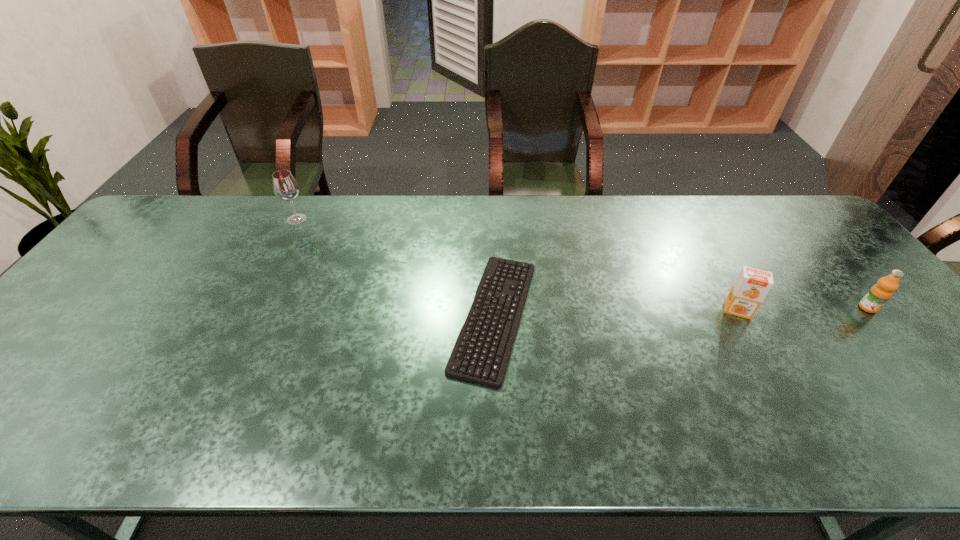
Locate an element on the screen. This screenshot has width=960, height=540. the tallest object is located at coordinates (285, 187).

Identify the location of wineglass. This screenshot has width=960, height=540. (285, 187).

I want to click on the left orange juice, so click(x=752, y=285).

Find the location of `the rightmost object`. the rightmost object is located at coordinates (880, 293).

You are a GUI agent. You are given a task and a screenshot of the screen. Output one action in this format:
    pyautogui.click(x=<x>, y=<y>)
    Task: Click on the shortest object
    
    Given the screenshot: What is the action you would take?
    pyautogui.click(x=494, y=265)

Image resolution: width=960 pixels, height=540 pixels. I want to click on computer keyboard, so click(x=494, y=265).

Where is `vacant space located on the front of the leftmost object`? vacant space located on the front of the leftmost object is located at coordinates pos(284,245).

The height and width of the screenshot is (540, 960). Identify the location of vacant region located 0.180m on the front of the second object from right to left. (777, 380).

At what (x,y) coordinates should I click in order to perform the action: click on vacant point located on the label of the rightmost object. Please return your answer as a coordinate pair (x, y). Looking at the image, I should click on (949, 404).

Find the location of `free space located on the left of the computer keyboard`. free space located on the left of the computer keyboard is located at coordinates (314, 315).